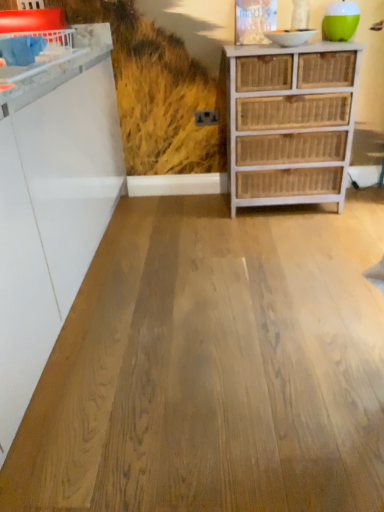
Question: Visually, is white glossy counter at upper left positioned to the left or to the right of natural wood floor at center?

Choices:
 (A) right
 (B) left

Answer: (B)

Question: Choose the correct answer: Is white glossy counter at upper left inside natural wood floor at center or outside it?

Choices:
 (A) inside
 (B) outside

Answer: (B)

Question: Estimate the real-world distances between objects in this image. Which object is closer to the white glossy counter at upper left?

Choices:
 (A) white wicker chest of drawers at right
 (B) natural wood floor at center

Answer: (A)

Question: Considering the real-world distances, which object is closest to the white wicker chest of drawers at right?

Choices:
 (A) white glossy counter at upper left
 (B) natural wood floor at center

Answer: (B)